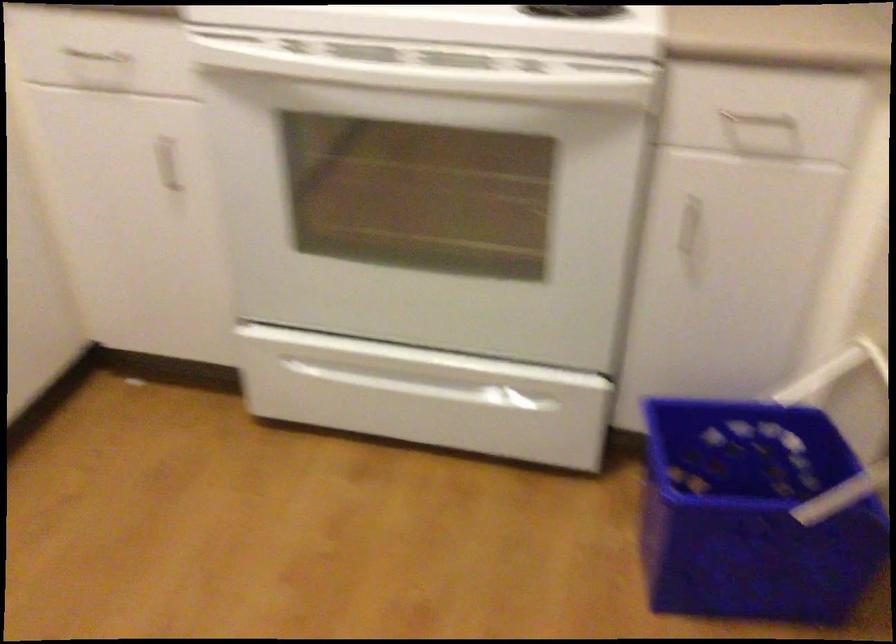
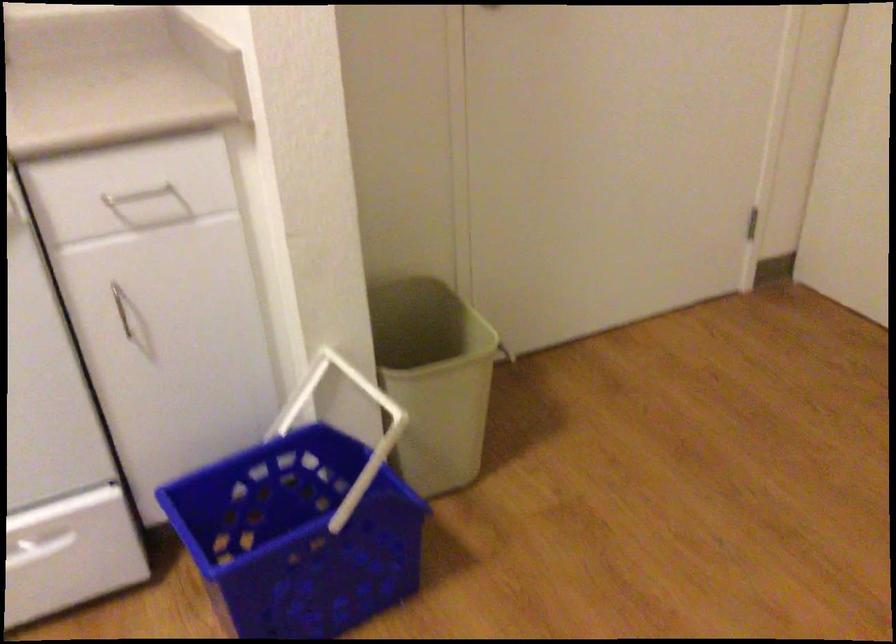
Where in the second image is the point corresponding to (x=755, y=116) from the first image?

(138, 194)